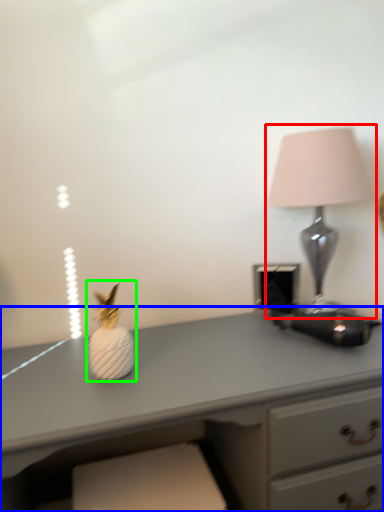
Question: Which object is the farthest from lamp (highlighted by a red box)? Choose among these: desk (highlighted by a blue box) or miniature (highlighted by a green box).

Choices:
 (A) desk
 (B) miniature

Answer: (B)